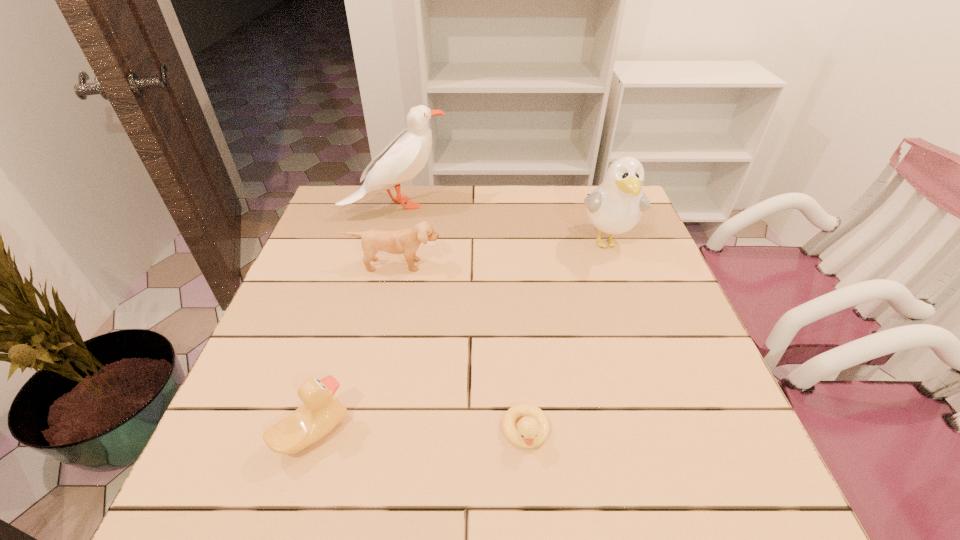
Find the location of `blank region between the second object from right to left and the right gull`. blank region between the second object from right to left and the right gull is located at coordinates (566, 336).

Locate an element on the screen. Image resolution: width=960 pixels, height=540 pixels. free point between the duck and the puppy is located at coordinates (354, 348).

This screenshot has height=540, width=960. I want to click on unoccupied position between the shortest object and the nearer gull, so click(566, 336).

In order to click on empty space that is in between the duck and the farthest object in this screenshot , I will do `click(354, 319)`.

In order to click on free space between the duck and the rightmost object in this screenshot , I will do `click(460, 337)`.

Identify which object is the second closest to the puppy. Please provide its 2D coordinates. Your answer should be formatted as a tuple, i.e. [(x, y)], where the tuple contains the x and y coordinates of a point satisfying the conditions above.

[(616, 205)]

This screenshot has width=960, height=540. What are the coordinates of `object that is the closest to the puppy` in the screenshot? It's located at (406, 155).

Identify the location of free point that satisfies the following two spatial constraints: 1. on the left side of the puppy; 2. at the beak of the duck. (358, 432).

Where is `free location that satisfies the following two spatial constraints: 1. at the beak of the duckling; 2. at the beak of the duck`? free location that satisfies the following two spatial constraints: 1. at the beak of the duckling; 2. at the beak of the duck is located at coordinates (526, 432).

You are a GUI agent. You are given a task and a screenshot of the screen. Output one action in this format:
    pyautogui.click(x=<x>, y=<y>)
    Task: Click on the vacant region that satisfies the following two spatial constraints: 1. on the beak of the rightmost object; 2. at the beak of the duck
    The image size is (960, 540).
    Given the screenshot: What is the action you would take?
    pyautogui.click(x=673, y=432)